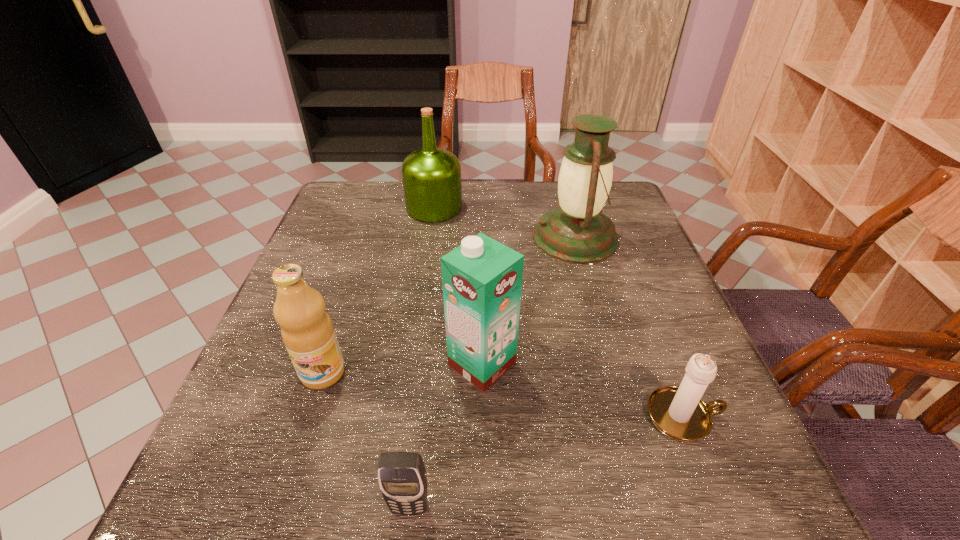
The image size is (960, 540). Identify the location of free space between the nearest object and the candle holder. (546, 461).

Where is `blank region between the leftmost object and the cellular telephone`? blank region between the leftmost object and the cellular telephone is located at coordinates (367, 440).

Locate an element on the screen. vacant space that's between the candle holder and the left olive oil is located at coordinates (503, 394).

You are a GUI agent. You are given a task and a screenshot of the screen. Output one action in this format:
    pyautogui.click(x=<x>, y=<y>)
    Task: Click on the object that ranks as the third closest to the carton
    
    Given the screenshot: What is the action you would take?
    pyautogui.click(x=679, y=413)

Locate an element on the screen. object that stands as the closest to the cellular telephone is located at coordinates (482, 279).

You are a GUI agent. You are given a task and a screenshot of the screen. Output one action in this format:
    pyautogui.click(x=<x>, y=<y>)
    Task: Click on the vacant region that satisfies the following two spatial constraints: 1. with the light compartment facing forward on the lantern; 2. on the label of the left olive oil
    
    Given the screenshot: What is the action you would take?
    pyautogui.click(x=612, y=373)

The height and width of the screenshot is (540, 960). Identify the location of vacant space that satisfies the following two spatial constraints: 1. with the light compartment facing forward on the lantern; 2. on the front side of the carton. (611, 364).

The image size is (960, 540). In order to click on free location that satisfies the following two spatial constraints: 1. with the light compartment facing forward on the lantern; 2. on the front side of the carton in this screenshot , I will do `click(611, 364)`.